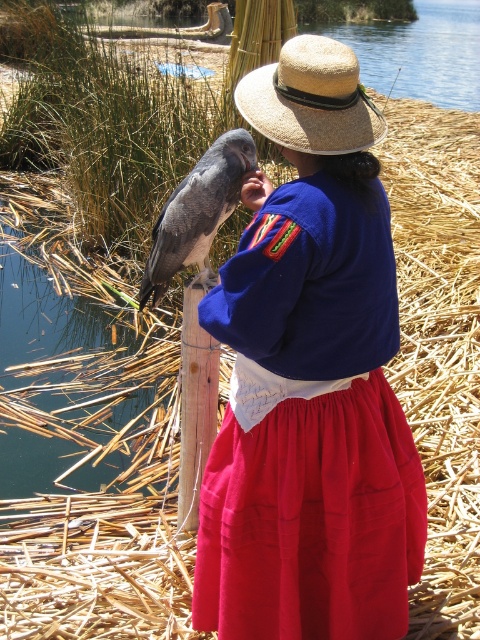
Question: Can you confirm if dark gray feathers at center is positioned to the left of wooden post at center?

Choices:
 (A) no
 (B) yes

Answer: (A)

Question: Is the position of matte straw hat at center more distant than that of dark gray feathers at center?

Choices:
 (A) yes
 (B) no

Answer: (B)

Question: Among these points, which one is farthest from the camera?

Choices:
 (A) (324, 116)
 (B) (195, 483)

Answer: (B)

Question: Which object is closer to the camera taking this photo?

Choices:
 (A) straw hat at center
 (B) dark gray feathers at center
 (C) matte straw hat at center

Answer: (C)

Question: Is matte straw hat at center further to camera compared to straw hat at center?

Choices:
 (A) yes
 (B) no

Answer: (B)

Question: Which point is farther from the camera taking this photo?

Choices:
 (A) (191, 355)
 (B) (300, 580)

Answer: (A)